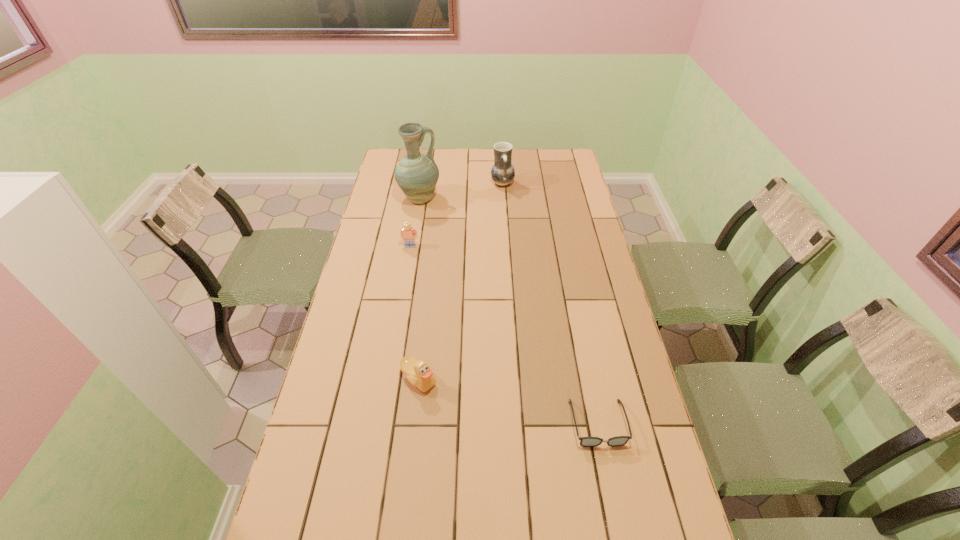
Locate an element on the screen. The height and width of the screenshot is (540, 960). unoccupied area between the fourth object from left to right and the shortest object is located at coordinates (550, 303).

You are a GUI agent. You are given a task and a screenshot of the screen. Output one action in this format:
    pyautogui.click(x=<x>, y=<y>)
    Task: Click on the free space between the nearest object and the pottery
    This screenshot has width=960, height=540.
    Given the screenshot: What is the action you would take?
    click(x=550, y=303)

Locate an element on the screen. free spot between the fourth farthest object and the tallest object is located at coordinates (420, 289).

Locate an element on the screen. vacant point located between the Lego and the fourth tallest object is located at coordinates coord(415,312).

Select which object appears as the closest to the third nearest object. Please provide its 2D coordinates. Your answer should be formatted as a tuple, i.e. [(x, y)], where the tuple contains the x and y coordinates of a point satisfying the conditions above.

[(417, 174)]

Image resolution: width=960 pixels, height=540 pixels. In order to click on the closest object to the third nearest object in this screenshot , I will do `click(417, 174)`.

The image size is (960, 540). Identify the location of free spot that satisfies the following two spatial constraints: 1. on the handle side of the tallest object; 2. on the front-facing side of the Lego. [412, 246].